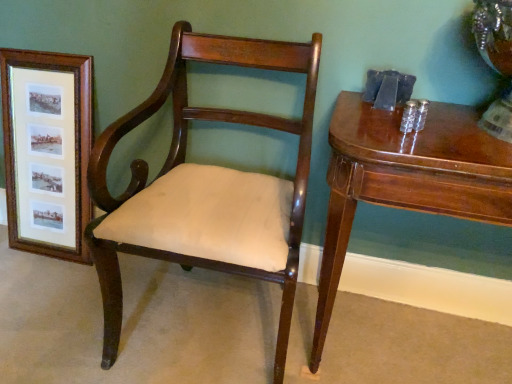
Where is `wooden framed prints at left`? Image resolution: width=512 pixels, height=384 pixels. wooden framed prints at left is located at coordinates (48, 149).

What do you see at coordinates (203, 186) in the screenshot?
I see `mahogany wood chair at center` at bounding box center [203, 186].

What is the approximate height of mahogany wood chair at center?

The height of mahogany wood chair at center is 34.06 inches.

Identify the location of wooden framed prints at left. The image size is (512, 384). (48, 149).

This screenshot has width=512, height=384. What are the coordinates of `table on the right of the mahogany wood chair at center` in the screenshot? It's located at (406, 179).

Does point (117, 334) come farther from viewer compared to point (350, 121)?

That is True.

Can you see mahogany wood chair at center touching glossy wood table at right?

They are not placed beside each other.

From the image's perspective, is mahogany wood chair at center above or below glossy wood table at right?

From the image's perspective, mahogany wood chair at center appears above glossy wood table at right.

Does glossy wood table at right have a lesser width compared to wooden framed prints at left?

No.

Is point (501, 149) closer to camera compared to point (62, 228)?

Yes, point (501, 149) is in front of point (62, 228).

Considering the relative sizes of glossy wood table at right and wooden framed prints at left in the image provided, is glossy wood table at right bigger than wooden framed prints at left?

Yes, glossy wood table at right is bigger than wooden framed prints at left.

Is mahogany wood chair at center thinner than wooden framed prints at left?

No, mahogany wood chair at center is not thinner than wooden framed prints at left.

Between mahogany wood chair at center and wooden framed prints at left, which one appears on the left side from the viewer's perspective?

From the viewer's perspective, wooden framed prints at left appears more on the left side.

From a real-world perspective, is mahogany wood chair at center under wooden framed prints at left?

Incorrect, from a real-world perspective, mahogany wood chair at center is higher than wooden framed prints at left.

Considering the positions of points (281, 349) and (47, 129), is point (281, 349) farther from camera compared to point (47, 129)?

No, it is in front of (47, 129).

From a real-world perspective, is wooden framed prints at left below mahogany wood chair at center?

Yes, from a real-world perspective, wooden framed prints at left is beneath mahogany wood chair at center.

Between point (58, 106) and point (260, 178), which one is positioned behind?

The point (58, 106) is behind.

Is wooden framed prints at left looking in the opposite direction of mahogany wood chair at center?

wooden framed prints at left is not turned away from mahogany wood chair at center.

Is wooden framed prints at left not within mahogany wood chair at center?

Yes, wooden framed prints at left is not within mahogany wood chair at center.

Is wooden framed prints at left inside or outside of glossy wood table at right?

wooden framed prints at left is not enclosed by glossy wood table at right.

Is wooden framed prints at left looking in the opposite direction of glossy wood table at right?

No.

How many degrees apart are the facing directions of wooden framed prints at left and glossy wood table at right?

The facing directions of wooden framed prints at left and glossy wood table at right are 0.0907 degrees apart.

Considering the sizes of objects wooden framed prints at left and glossy wood table at right in the image provided, who is smaller, wooden framed prints at left or glossy wood table at right?

Smaller between the two is wooden framed prints at left.

From the picture: Are glossy wood table at right and mahogany wood chair at center beside each other?

They are not placed beside each other.

Measure the distance between glossy wood table at right and mahogany wood chair at center.

glossy wood table at right and mahogany wood chair at center are 11.05 inches apart from each other.

You are a GUI agent. You are given a task and a screenshot of the screen. Output one action in this format:
    pyautogui.click(x=<x>, y=<y>)
    Task: Click on the chair in front of the glossy wood table at right
    
    Given the screenshot: What is the action you would take?
    pyautogui.click(x=203, y=186)

Which object is wider, glossy wood table at right or mahogany wood chair at center?

Wider between the two is mahogany wood chair at center.

Locate an element on the screen. table behind the mahogany wood chair at center is located at coordinates (406, 179).

The width and height of the screenshot is (512, 384). I want to click on picture frame on the left of glossy wood table at right, so click(x=48, y=149).

Looking at the image, which one is located further to mahogany wood chair at center, wooden framed prints at left or glossy wood table at right?

wooden framed prints at left is further to mahogany wood chair at center.

From the image, which object appears to be nearer to wooden framed prints at left, glossy wood table at right or mahogany wood chair at center?

Based on the image, mahogany wood chair at center appears to be nearer to wooden framed prints at left.

When comparing their distances from glossy wood table at right, does mahogany wood chair at center or wooden framed prints at left seem further?

The object further to glossy wood table at right is wooden framed prints at left.

Considering their positions, is glossy wood table at right positioned closer to mahogany wood chair at center than wooden framed prints at left?

Based on the image, glossy wood table at right appears to be nearer to mahogany wood chair at center.

Looking at the image, which one is located further to wooden framed prints at left, mahogany wood chair at center or glossy wood table at right?

glossy wood table at right.

Based on the photo, when comparing their distances from glossy wood table at right, does wooden framed prints at left or mahogany wood chair at center seem further?

wooden framed prints at left.

Where is `chair situated between wooden framed prints at left and glossy wood table at right from left to right`? The image size is (512, 384). chair situated between wooden framed prints at left and glossy wood table at right from left to right is located at coordinates (203, 186).